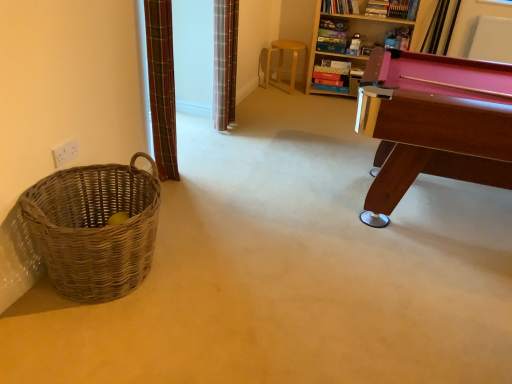
Question: Should I look upward or downward to see plaid fabric curtain at left, the first curtain positioned from the left?

Choices:
 (A) up
 (B) down

Answer: (A)

Question: Is wooden bookcase at upper right to the left of pink wood pool table at right from the viewer's perspective?

Choices:
 (A) no
 (B) yes

Answer: (B)

Question: Can you confirm if wooden bookcase at upper right is smaller than pink wood pool table at right?

Choices:
 (A) no
 (B) yes

Answer: (B)

Question: Is there a large distance between wooden bookcase at upper right and pink wood pool table at right?

Choices:
 (A) yes
 (B) no

Answer: (A)

Question: Does wooden bookcase at upper right come behind pink wood pool table at right?

Choices:
 (A) yes
 (B) no

Answer: (A)

Question: Is wooden bookcase at upper right shorter than pink wood pool table at right?

Choices:
 (A) no
 (B) yes

Answer: (A)

Question: Is wooden bookcase at upper right oriented towards pink wood pool table at right?

Choices:
 (A) yes
 (B) no

Answer: (A)

Question: Would you say light brown wooden stool at center contains plaid fabric curtain at left, the first curtain positioned from the left?

Choices:
 (A) yes
 (B) no

Answer: (B)

Question: Can you confirm if light brown wooden stool at center is shorter than plaid fabric curtain at left, the first curtain positioned from the left?

Choices:
 (A) yes
 (B) no

Answer: (A)

Question: Is light brown wooden stool at center outside plaid fabric curtain at left, the first curtain from the front?

Choices:
 (A) yes
 (B) no

Answer: (A)

Question: Is light brown wooden stool at center in front of plaid fabric curtain at left, the first curtain from the front?

Choices:
 (A) yes
 (B) no

Answer: (B)

Question: From the image's perspective, would you say light brown wooden stool at center is shown under plaid fabric curtain at left, which is the 2th curtain from back to front?

Choices:
 (A) yes
 (B) no

Answer: (B)

Question: Considering the relative positions of light brown wooden stool at center and plaid fabric curtain at left, which is the 2th curtain from back to front, in the image provided, is light brown wooden stool at center to the left of plaid fabric curtain at left, which is the 2th curtain from back to front, from the viewer's perspective?

Choices:
 (A) no
 (B) yes

Answer: (A)

Question: Does light brown wooden stool at center touch wooden bookcase at upper right?

Choices:
 (A) yes
 (B) no

Answer: (B)